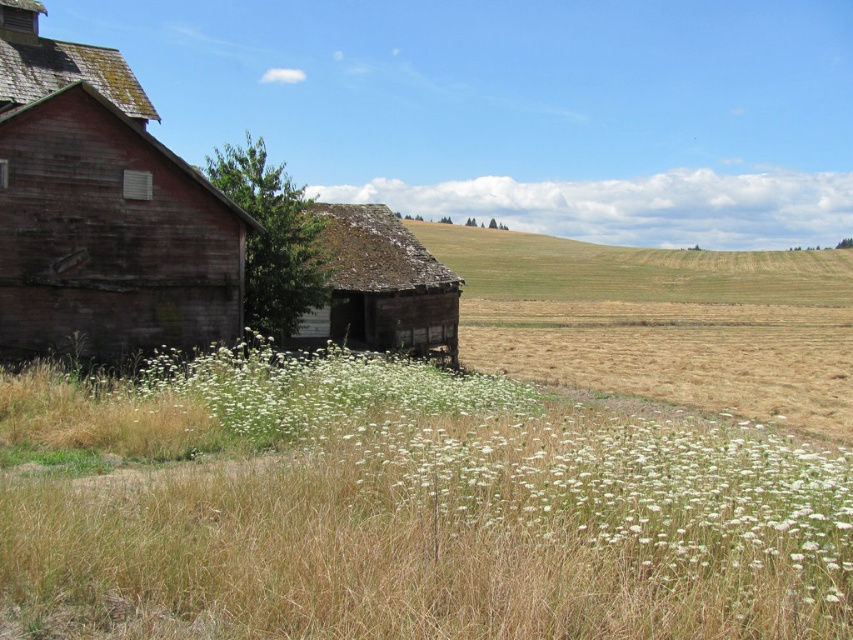
Question: Which object appears farthest from the camera in this image?

Choices:
 (A) rustic wooden barn at left
 (B) white fluffy flowers at center
 (C) rusty wood hut at center

Answer: (C)

Question: Is rustic wooden barn at left above rusty wood hut at center?

Choices:
 (A) yes
 (B) no

Answer: (A)

Question: Which point is farther to the camera?

Choices:
 (A) (329, 451)
 (B) (314, 314)

Answer: (B)

Question: Estimate the real-world distances between objects in this image. Which object is closer to the white fluffy flowers at center?

Choices:
 (A) rusty wood hut at center
 (B) rustic wooden barn at left

Answer: (B)

Question: From the image, what is the correct spatial relationship of white fluffy flowers at center in relation to rusty wood hut at center?

Choices:
 (A) below
 (B) above

Answer: (A)

Question: Is the position of rustic wooden barn at left more distant than that of rusty wood hut at center?

Choices:
 (A) no
 (B) yes

Answer: (A)